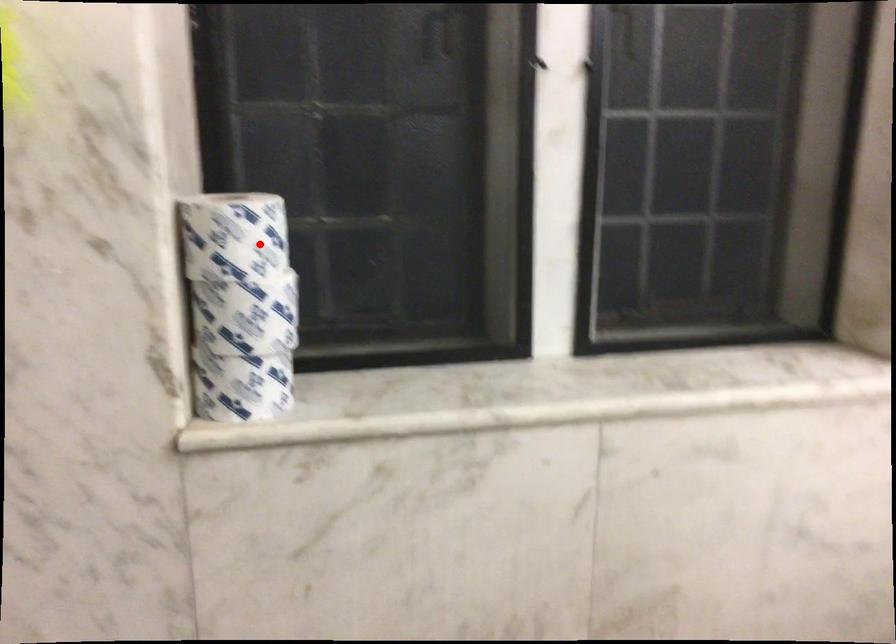
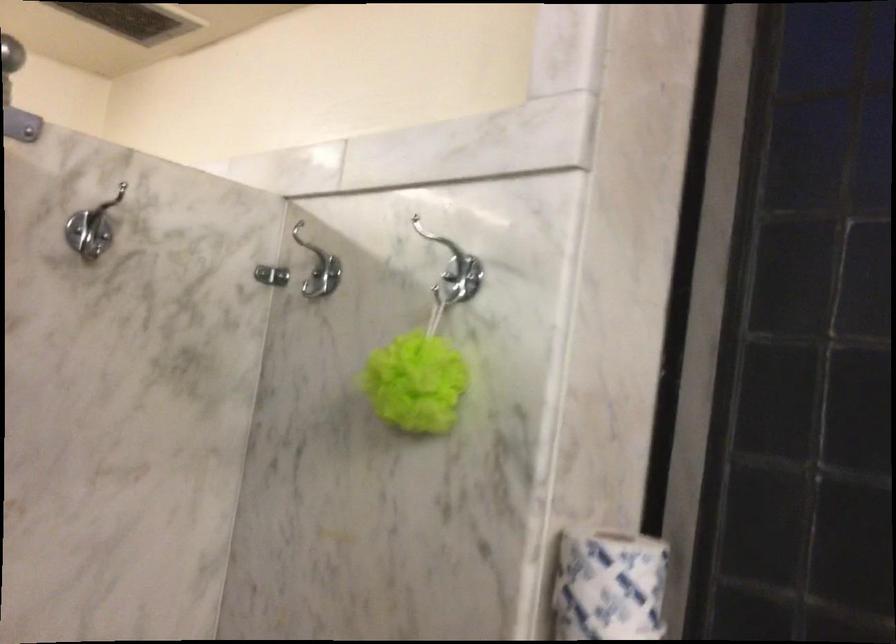
Find the pixel in the second image that matches the highlighted location in the first image.

(607, 585)